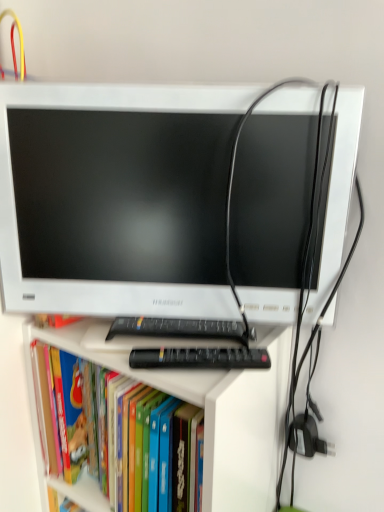
Question: Is hardcover book at center positioned beyond the bounds of white plastic computer monitor at center?

Choices:
 (A) yes
 (B) no

Answer: (A)

Question: Is hardcover book at center taller than white plastic computer monitor at center?

Choices:
 (A) no
 (B) yes

Answer: (A)

Question: Considering the relative positions of hardcover book at center and white plastic computer monitor at center in the image provided, is hardcover book at center to the left of white plastic computer monitor at center from the viewer's perspective?

Choices:
 (A) yes
 (B) no

Answer: (A)

Question: Is the depth of hardcover book at center greater than that of white plastic computer monitor at center?

Choices:
 (A) no
 (B) yes

Answer: (B)

Question: Is white plastic computer monitor at center at the back of hardcover book at center?

Choices:
 (A) no
 (B) yes

Answer: (A)

Question: From the image's perspective, is hardcover book at center under white plastic computer monitor at center?

Choices:
 (A) yes
 (B) no

Answer: (A)

Question: Does white plastic computer monitor at center contain hardcover book at center?

Choices:
 (A) yes
 (B) no

Answer: (B)

Question: Could you tell me if white plastic computer monitor at center is turned towards hardcover book at center?

Choices:
 (A) yes
 (B) no

Answer: (B)

Question: Is white plastic computer monitor at center beside hardcover book at center?

Choices:
 (A) no
 (B) yes

Answer: (A)

Question: From a real-world perspective, is white plastic computer monitor at center beneath hardcover book at center?

Choices:
 (A) no
 (B) yes

Answer: (A)

Question: Is white plastic computer monitor at center far away from hardcover book at center?

Choices:
 (A) no
 (B) yes

Answer: (A)

Question: From a real-world perspective, is white plastic computer monitor at center on top of hardcover book at center?

Choices:
 (A) no
 (B) yes

Answer: (B)

Question: Can you confirm if black plastic keyboard at center is smaller than hardcover book at center?

Choices:
 (A) no
 (B) yes

Answer: (B)